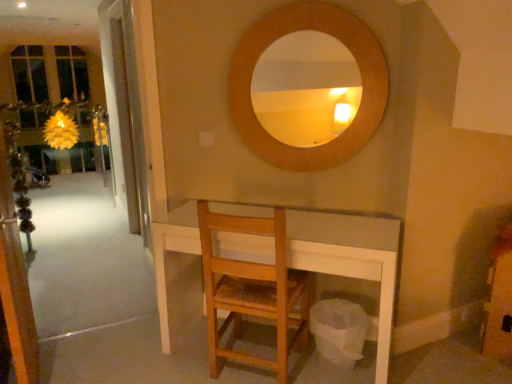
Where is `vacant space positioned to the left of wooden chair at center`? This screenshot has height=384, width=512. vacant space positioned to the left of wooden chair at center is located at coordinates (178, 363).